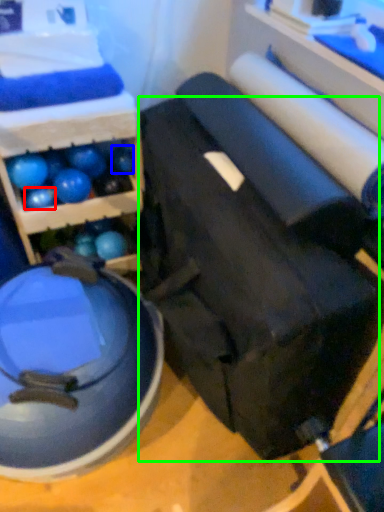
Question: Based on their relative distances, which object is nearer to ball (highlighted by a red box)? Choose from ball (highlighted by a blue box) and swivel chair (highlighted by a green box).

Choices:
 (A) ball
 (B) swivel chair

Answer: (A)